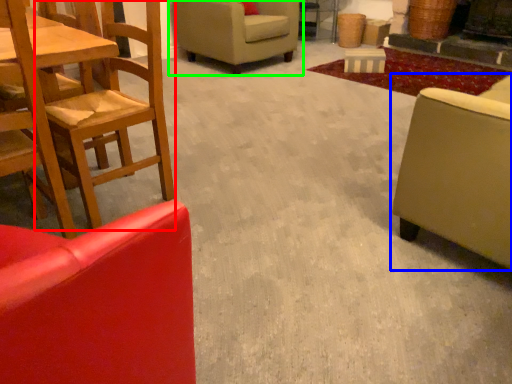
Question: Which is farther away from chair (highlighted by a red box)? studio couch (highlighted by a blue box) or chair (highlighted by a green box)?

Choices:
 (A) studio couch
 (B) chair

Answer: (B)